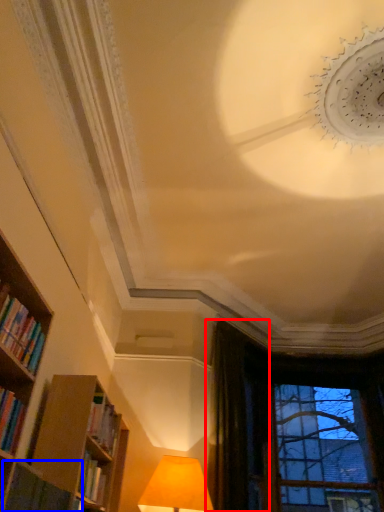
Question: Which object is further to the camera taking this photo, curtain (highlighted by a red box) or book (highlighted by a blue box)?

Choices:
 (A) curtain
 (B) book

Answer: (A)